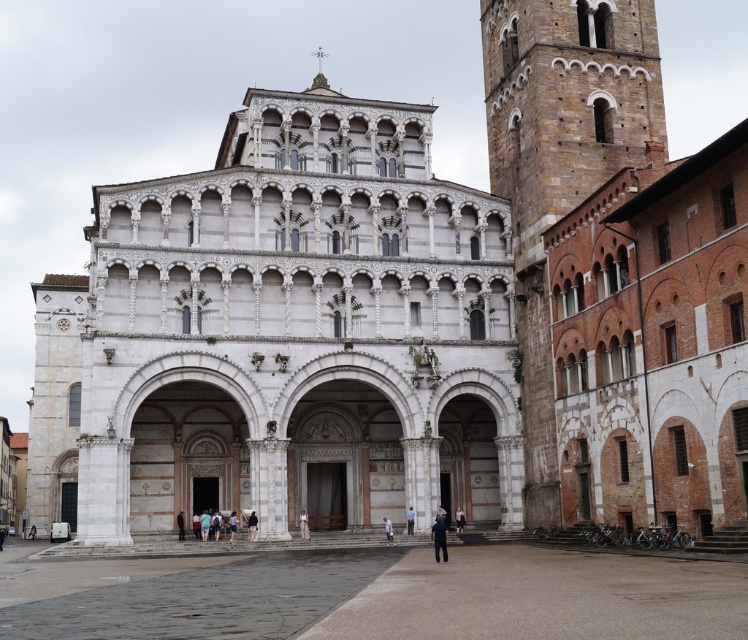
You are standing in front of the grand historical building and notice an object on the ground. Where exactly is the black leather jacket at center located in terms of coordinates?

The black leather jacket at center is located at coordinates point [251,525].

You are a fashion designer who wants to create a new outfit using the black leather jacket at center and the blue denim jeans at center from the image. Considering their sizes, which item would you need to adjust first to ensure they fit together proportionally?

The black leather jacket at center is wider than the blue denim jeans at center, so you would need to adjust the blue denim jeans at center first to match the jacket width.

You are standing in front of the grand historical building and see a black leather jacket at center and blue denim jeans at center. If you want to pick up both items, which one should you go to first to minimize the distance you walk?

You should go to the black leather jacket at center first because it is at the same location as the blue denim jeans at center, so the distance between them is only 10.84 meters. However, since both are at the center, you can pick them up in any order without extra walking distance.